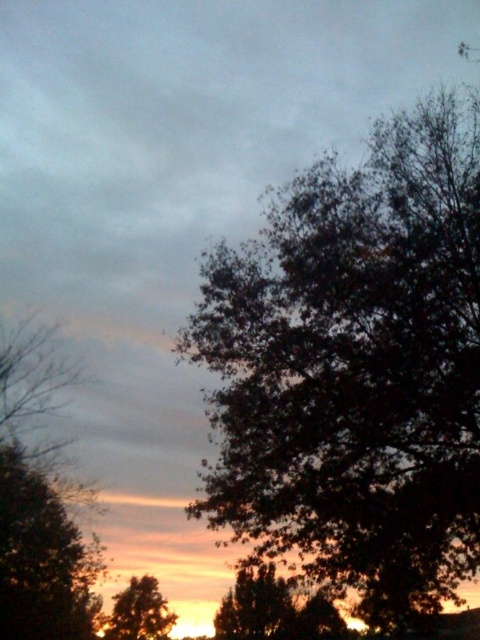
Is point (350, 477) in front of point (151, 586)?

That is True.

Does dark green leafy tree at right have a lesser height compared to brown textured tree at lower left?

No.

The height and width of the screenshot is (640, 480). I want to click on dark green leafy tree at right, so click(x=356, y=365).

Identify the location of dark green leafy tree at right. (356, 365).